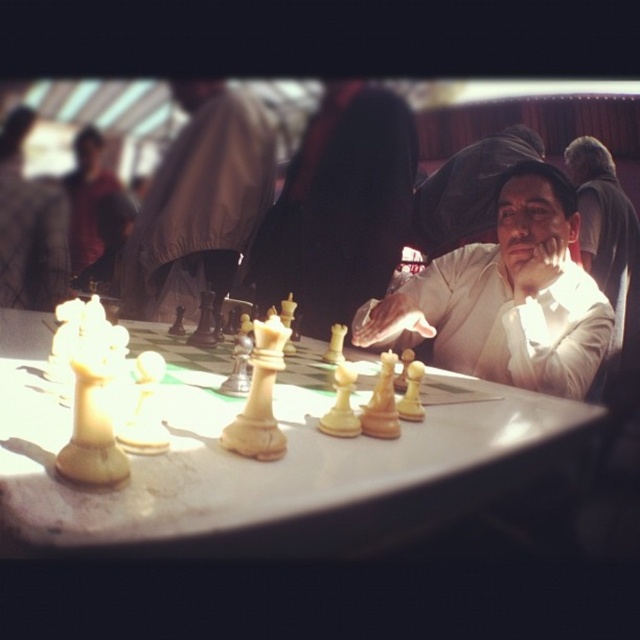
Is matte black chess piece at center closer to the viewer compared to white glossy chess piece at center?

No, matte black chess piece at center is behind white glossy chess piece at center.

The height and width of the screenshot is (640, 640). What do you see at coordinates (198, 204) in the screenshot?
I see `matte black chess piece at center` at bounding box center [198, 204].

Identify the location of matte black chess piece at center. (198, 204).

Is matte white chess piece at left closer to the viewer compared to white glossy chess piece at center?

That is False.

Which of these two, matte white chess piece at left or white glossy chess piece at center, stands shorter?

With less height is matte white chess piece at left.

The height and width of the screenshot is (640, 640). Describe the element at coordinates (29, 227) in the screenshot. I see `matte white chess piece at left` at that location.

Locate an element on the screen. The height and width of the screenshot is (640, 640). matte white chess piece at left is located at coordinates (29, 227).

Consider the image. Which is more to the left, white glossy chessboard at center or matte black chess piece at center?

Positioned to the left is matte black chess piece at center.

Is white glossy chessboard at center wider than matte black chess piece at center?

Indeed, white glossy chessboard at center has a greater width compared to matte black chess piece at center.

Which is behind, point (86, 550) or point (186, 218)?

The point (186, 218) is behind.

Locate an element on the screen. white glossy chessboard at center is located at coordinates (262, 464).